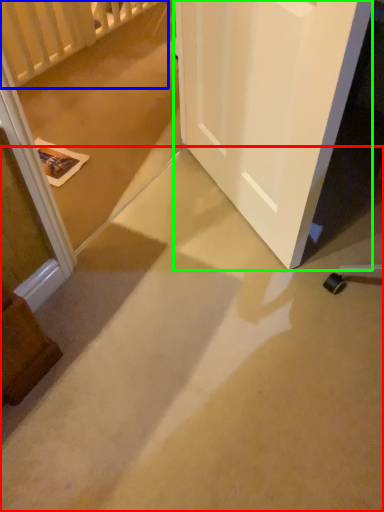
Question: Estimate the real-world distances between objects in this image. Which object is closer to concrete (highlighted by a red box), balustrade (highlighted by a blue box) or door (highlighted by a green box)?

Choices:
 (A) balustrade
 (B) door

Answer: (B)